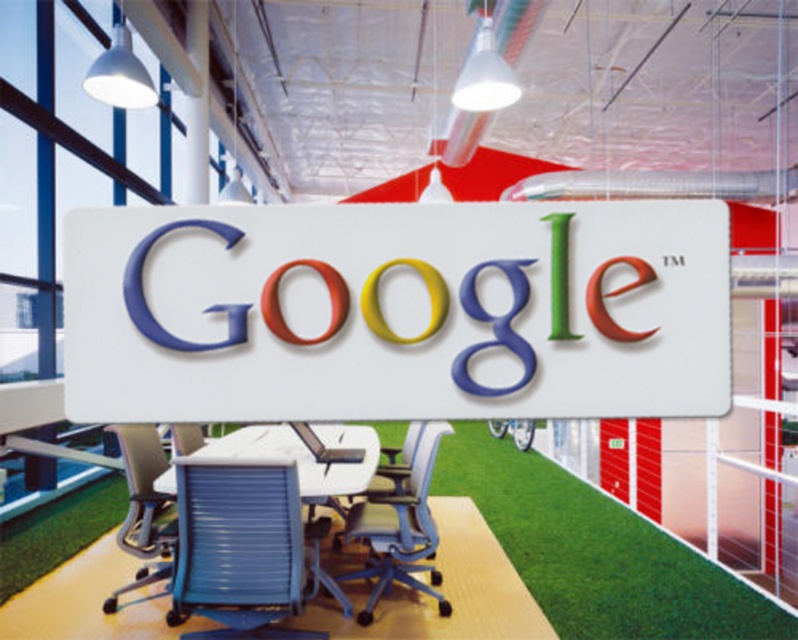
Question: Which of these objects is positioned closest to the matte blue office chair at center?

Choices:
 (A) blue mesh swivel chair at lower left
 (B) white glossy sign at center
 (C) blue mesh office chair at lower left

Answer: (A)

Question: Does white glossy sign at center have a smaller size compared to blue mesh swivel chair at lower left?

Choices:
 (A) no
 (B) yes

Answer: (B)

Question: Is white glossy sign at center behind blue mesh office chair at lower left?

Choices:
 (A) no
 (B) yes

Answer: (A)

Question: Which point appears closest to the camera in this image?

Choices:
 (A) (125, 534)
 (B) (385, 298)
 (C) (372, 506)

Answer: (B)

Question: Observing the image, what is the correct spatial positioning of white glossy sign at center in reference to matte blue office chair at center?

Choices:
 (A) right
 (B) left

Answer: (B)

Question: Which is farther from the blue mesh swivel chair at lower left?

Choices:
 (A) blue mesh office chair at lower left
 (B) matte blue office chair at center

Answer: (B)